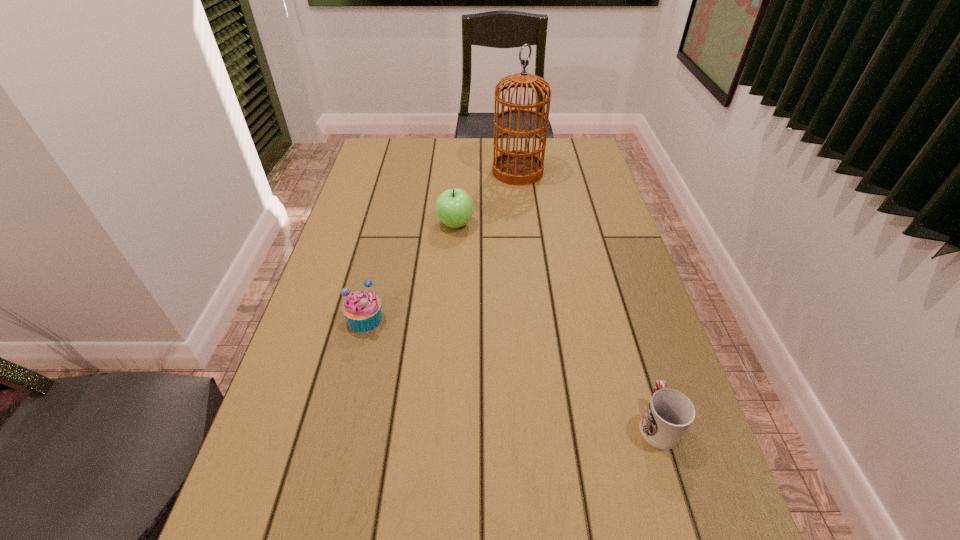
Identify the location of free space located on the right of the leftmost object. (418, 319).

This screenshot has height=540, width=960. What are the coordinates of `vacant point located 0.210m on the side of the cup where the handle is located` in the screenshot? It's located at (626, 320).

At what (x,y) coordinates should I click in order to perform the action: click on vacant space located 0.300m on the side of the cup where the handle is located. Please return your answer as a coordinate pair (x, y). The width and height of the screenshot is (960, 540). Looking at the image, I should click on (617, 293).

This screenshot has height=540, width=960. Identify the location of vacant space located on the side of the cup where the handle is located. (615, 287).

Locate an element on the screen. This screenshot has height=540, width=960. object situated at the far edge is located at coordinates (516, 167).

You are a GUI agent. You are given a task and a screenshot of the screen. Output one action in this format:
    pyautogui.click(x=<x>, y=<y>)
    Task: Click on the object situated at the left edge
    Image resolution: width=960 pixels, height=540 pixels.
    Given the screenshot: What is the action you would take?
    pyautogui.click(x=362, y=309)

Identify the location of object present at the right edge. (669, 414).

This screenshot has width=960, height=540. I want to click on vacant space at the far edge of the desktop, so [447, 151].

Identify the location of free region at the left edge of the desktop. This screenshot has width=960, height=540. (401, 182).

Identify the location of vacant space at the right edge of the desktop. (588, 179).